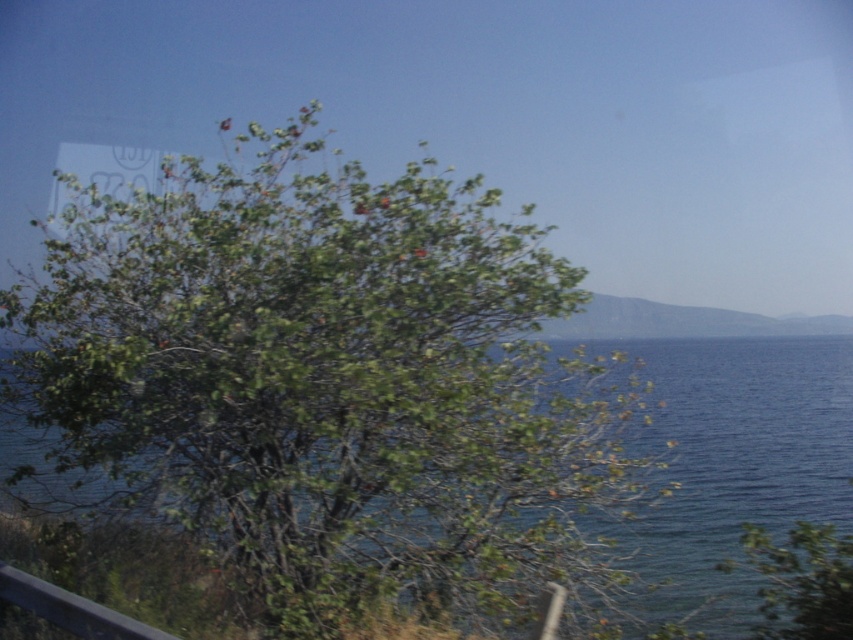
You are standing on a cliff overlooking the ocean and see the blue liquid water at center and the dark gray metal rail at lower left. Which object appears higher in the image?

The blue liquid water at center appears higher in the image because it is taller than the dark gray metal rail at lower left.

You are standing at the center of the image and want to walk towards the green leafy tree at center. In which direction should you move?

Since the green leafy tree at center is located at point coordinates of 0.602 on the x axis and 0.386 on the y axis, you should move to the right and slightly upwards to reach it.